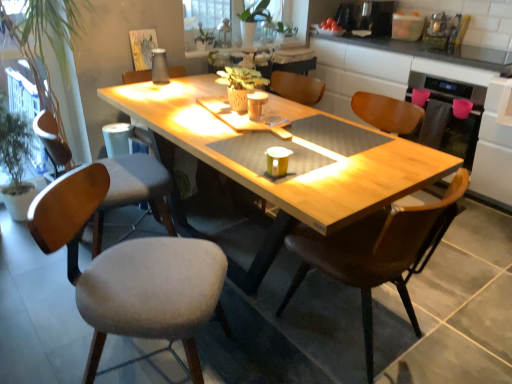
Question: Which direction should I rotate to face matte brown coffee cup at center, the 2th coffee cup viewed from the front, — up or down?

Choices:
 (A) up
 (B) down

Answer: (A)

Question: Does green leafy plant at left, the 2th houseplant when ordered from back to front, touch light gray fabric chair at left, the second chair from the left?

Choices:
 (A) yes
 (B) no

Answer: (B)

Question: Is green leafy plant at left, which is counted as the 2th houseplant, starting from the top, surrounding light gray fabric chair at left, the second chair viewed from the right?

Choices:
 (A) yes
 (B) no

Answer: (B)

Question: Can you confirm if green leafy plant at left, the 2th houseplant when ordered from back to front, is bigger than light gray fabric chair at left, the second chair viewed from the right?

Choices:
 (A) yes
 (B) no

Answer: (A)

Question: Can you confirm if green leafy plant at left, the 2th houseplant when ordered from back to front, is shorter than light gray fabric chair at left, the second chair viewed from the right?

Choices:
 (A) yes
 (B) no

Answer: (B)

Question: Considering the relative sizes of green leafy plant at left, the 1th houseplant from the bottom, and light gray fabric chair at left, the second chair viewed from the right, in the image provided, is green leafy plant at left, the 1th houseplant from the bottom, thinner than light gray fabric chair at left, the second chair viewed from the right,?

Choices:
 (A) yes
 (B) no

Answer: (B)

Question: Does green leafy plant at left, marked as the 1th houseplant in a front-to-back arrangement, have a greater width compared to light gray fabric chair at left, the second chair from the left?

Choices:
 (A) no
 (B) yes

Answer: (B)

Question: Is wooden counter at upper right with green matte plant at upper center, the first houseplant viewed from the top?

Choices:
 (A) no
 (B) yes

Answer: (A)

Question: Is wooden counter at upper right to the left of green matte plant at upper center, placed as the first houseplant when sorted from right to left, from the viewer's perspective?

Choices:
 (A) no
 (B) yes

Answer: (A)

Question: Would you say wooden counter at upper right is a long distance from green matte plant at upper center, the second houseplant positioned from the bottom?

Choices:
 (A) yes
 (B) no

Answer: (B)

Question: From the image's perspective, would you say wooden counter at upper right is positioned over green matte plant at upper center, the second houseplant positioned from the bottom?

Choices:
 (A) yes
 (B) no

Answer: (B)

Question: From a real-world perspective, does wooden counter at upper right stand above green matte plant at upper center, the 2th houseplant viewed from the front?

Choices:
 (A) yes
 (B) no

Answer: (B)

Question: Is wooden counter at upper right not within green matte plant at upper center, the second houseplant positioned from the bottom?

Choices:
 (A) no
 (B) yes

Answer: (B)

Question: From the image's perspective, would you say light gray fabric chair at left, the second chair viewed from the right, is shown under white sheer curtain at upper center?

Choices:
 (A) no
 (B) yes

Answer: (B)